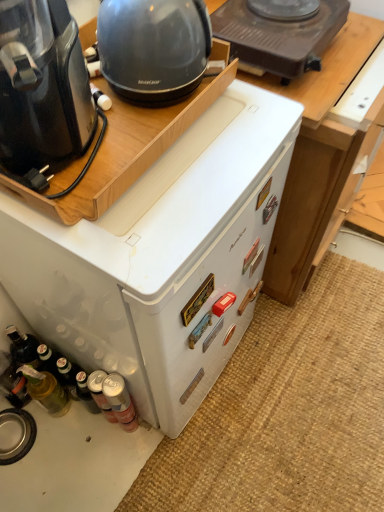
Locate an element on the screen. Image resolution: width=384 pixels, height=512 pixels. vacant space to the right of metallic silver can at lower left, arranged as the 2th bottle when viewed from the left is located at coordinates (180, 441).